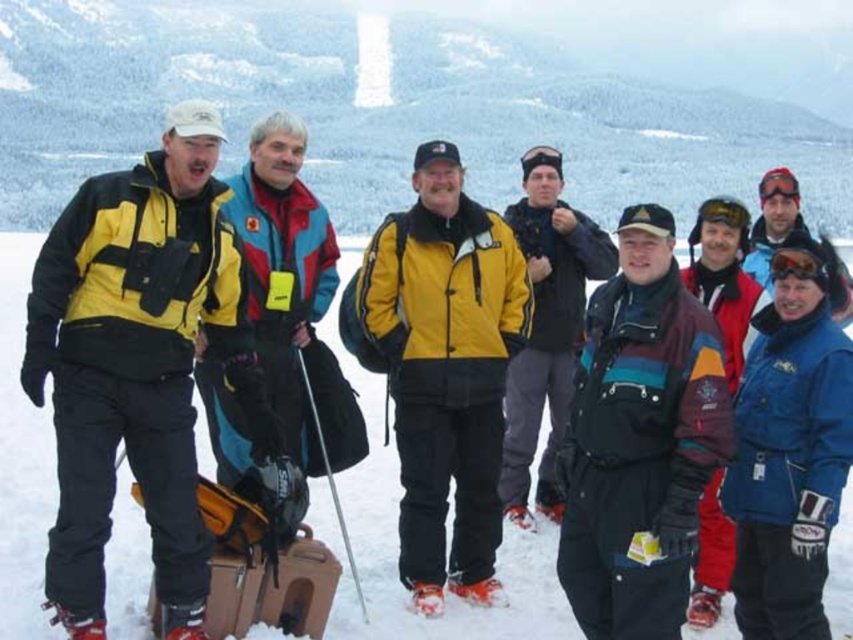
Can you confirm if white fluffy snow at center is smaller than multicolored fleece jacket at center?

No, white fluffy snow at center is not smaller than multicolored fleece jacket at center.

Which is below, white fluffy snow at center or multicolored fleece jacket at center?

multicolored fleece jacket at center is below.

What do you see at coordinates (396, 540) in the screenshot? I see `white fluffy snow at center` at bounding box center [396, 540].

You are a GUI agent. You are given a task and a screenshot of the screen. Output one action in this format:
    pyautogui.click(x=<x>, y=<y>)
    Task: Click on the white fluffy snow at center
    The image size is (853, 640).
    Given the screenshot: What is the action you would take?
    pyautogui.click(x=396, y=540)

Does multicolored fleece jacket at center appear under yellow matte jacket at center?

Correct, multicolored fleece jacket at center is located below yellow matte jacket at center.

Locate an element on the screen. multicolored fleece jacket at center is located at coordinates (640, 440).

Image resolution: width=853 pixels, height=640 pixels. Find the location of `multicolored fleece jacket at center`. multicolored fleece jacket at center is located at coordinates (640, 440).

Is matte black jacket at center positioned at the back of blue fleece jacket at upper right?

Yes, matte black jacket at center is further from the viewer.

Which is behind, point (549, 484) or point (751, 266)?

The point (751, 266) is behind.

Describe the element at coordinates (546, 326) in the screenshot. I see `matte black jacket at center` at that location.

Locate an element on the screen. This screenshot has width=853, height=640. matte black jacket at center is located at coordinates (546, 326).